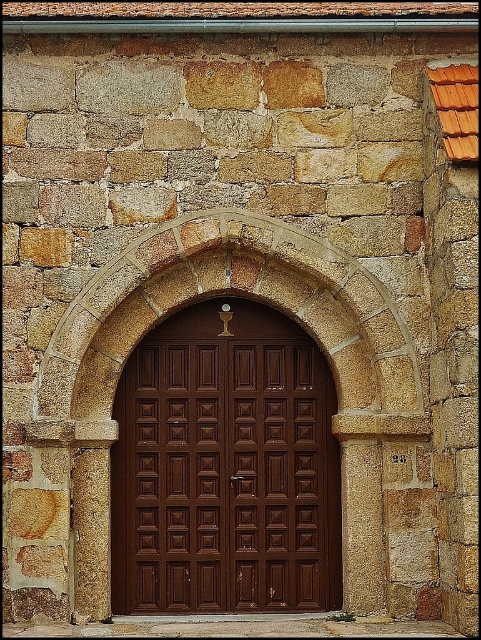
Question: Which point is farther from the camera taking this photo?

Choices:
 (A) (137, 563)
 (B) (420, 432)

Answer: (A)

Question: Does brown wooden door at center come in front of stone textured archway at center?

Choices:
 (A) yes
 (B) no

Answer: (B)

Question: Can you confirm if brown wooden door at center is positioned below stone textured archway at center?

Choices:
 (A) no
 (B) yes

Answer: (B)

Question: Can you confirm if brown wooden door at center is wider than stone textured archway at center?

Choices:
 (A) yes
 (B) no

Answer: (B)

Question: Which of the following is the closest to the observer?

Choices:
 (A) brown wooden door at center
 (B) stone textured archway at center

Answer: (B)

Question: Which of the following is the closest to the observer?

Choices:
 (A) (414, 388)
 (B) (174, 387)

Answer: (A)